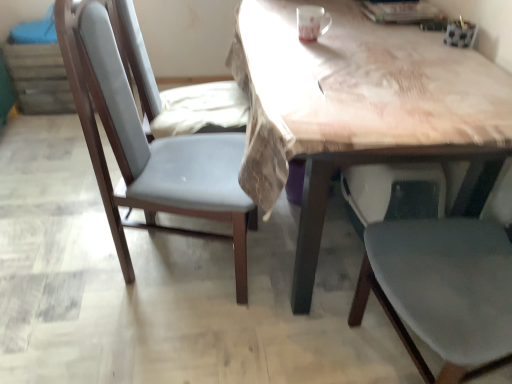
Question: From a real-world perspective, is matte gray chair at center positioned above or below wooden table at center?

Choices:
 (A) below
 (B) above

Answer: (A)

Question: Would you say matte gray chair at center is inside or outside wooden table at center?

Choices:
 (A) inside
 (B) outside

Answer: (B)

Question: Looking at their shapes, would you say matte gray chair at center is wider or thinner than wooden table at center?

Choices:
 (A) wide
 (B) thin

Answer: (B)

Question: From their relative heights in the image, would you say wooden table at center is taller or shorter than matte gray chair at center?

Choices:
 (A) tall
 (B) short

Answer: (B)

Question: Does point (311, 84) appear closer or farther from the camera than point (210, 158)?

Choices:
 (A) closer
 (B) farther

Answer: (A)

Question: Relative to matte gray chair at center, is wooden table at center in front or behind?

Choices:
 (A) front
 (B) behind

Answer: (A)

Question: Looking at their shapes, would you say wooden table at center is wider or thinner than matte gray chair at center?

Choices:
 (A) thin
 (B) wide

Answer: (B)